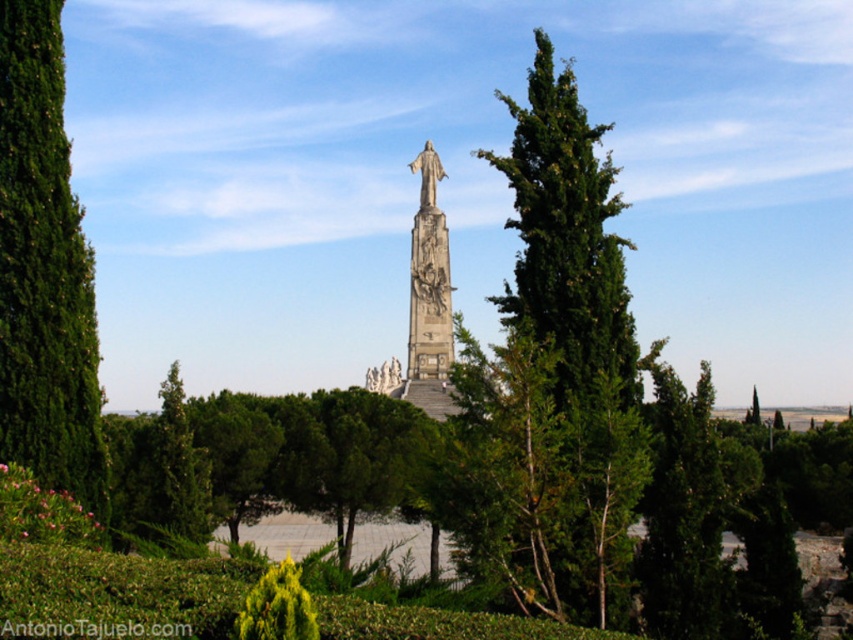
Which is below, green textured tree at left or stone statue at center?

Positioned lower is green textured tree at left.

This screenshot has width=853, height=640. In order to click on green textured tree at left in this screenshot , I will do pos(44,269).